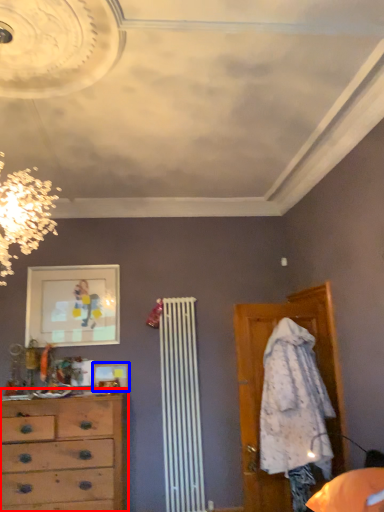
Question: Which object is further to the camera taking this photo, chest of drawers (highlighted by a red box) or picture frame (highlighted by a blue box)?

Choices:
 (A) chest of drawers
 (B) picture frame

Answer: (B)